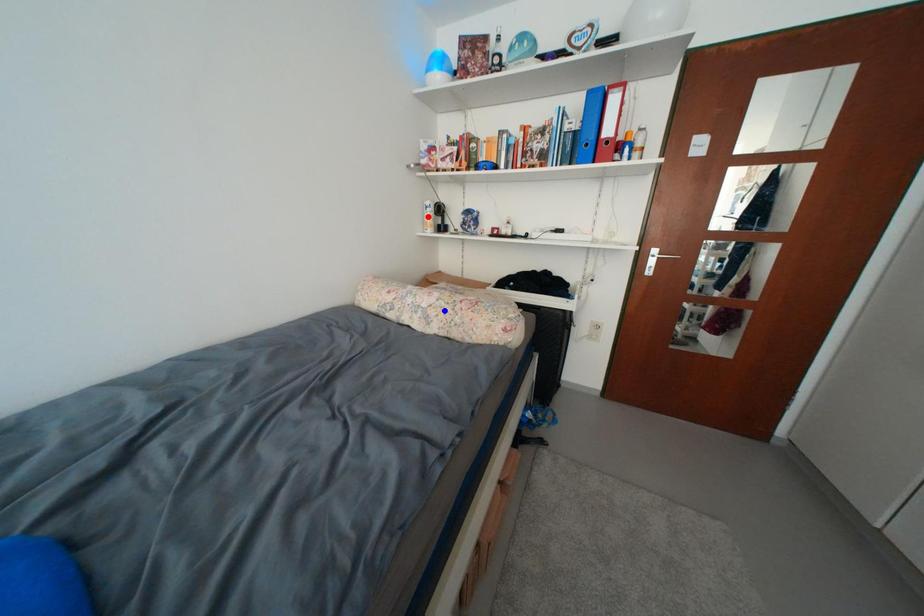
Question: In the image, two points are highlighted. Which point is nearer to the camera? Reply with the corresponding letter.

Choices:
 (A) blue point
 (B) red point

Answer: (A)